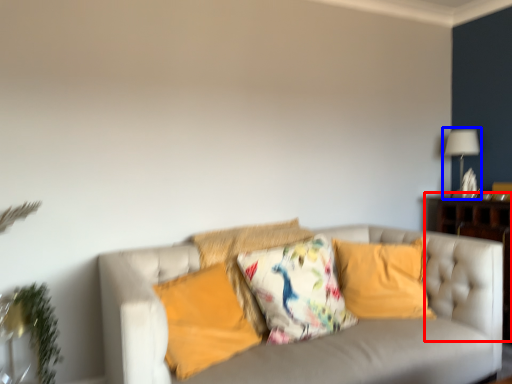
Question: Which object appears closest to the camera in this image, dresser (highlighted by a red box) or table lamp (highlighted by a blue box)?

Choices:
 (A) dresser
 (B) table lamp

Answer: (A)